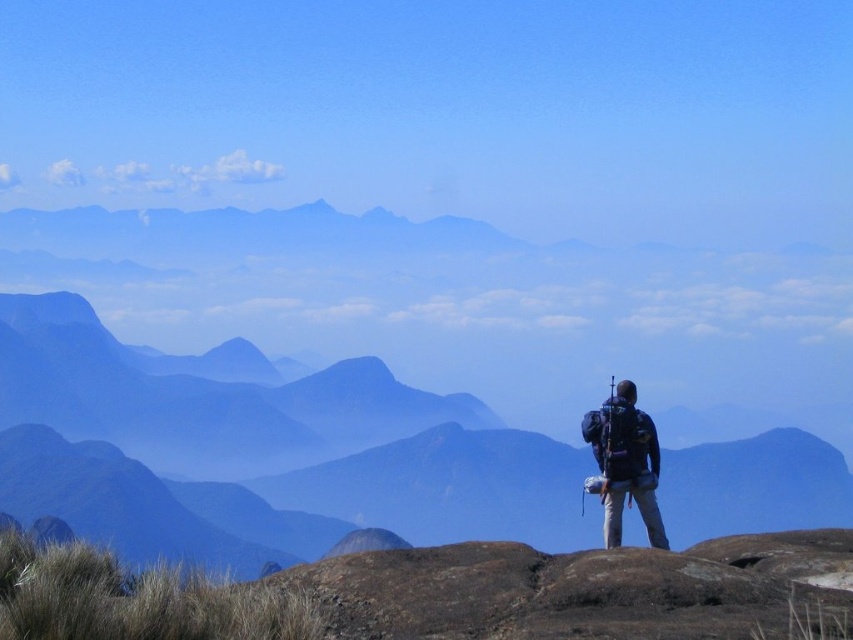
Looking at this image, you are a drone operator tasked with capturing aerial footage of the scene. The drone is currently hovering at the center of the image. To get a clear shot of the smooth rock mountain at center, should you move the drone towards the point at coordinates point (292, 436)?

Yes, the smooth rock mountain at center is located at point (292, 436), so moving the drone towards that point will ensure a clear shot of the smooth rock mountain at center.

You are a photographer planning to take a photo of the smooth rock mountain at center and the dark blue fabric backpack at right. Based on their positions, which object should you focus on first to ensure both are in sharp focus?

The smooth rock mountain at center is closer to the viewer than the dark blue fabric backpack at right, so you should focus on the smooth rock mountain at center first to ensure both are in sharp focus.

You are planning to take a photo of the smooth rock mountain at center and the dark blue fabric backpack at right. Since you want both objects to be clearly visible in the photo, which one should you focus on first to ensure proper depth of field?

The smooth rock mountain at center is much taller than the dark blue fabric backpack at right, so you should focus on the smooth rock mountain at center first to ensure both are in focus.